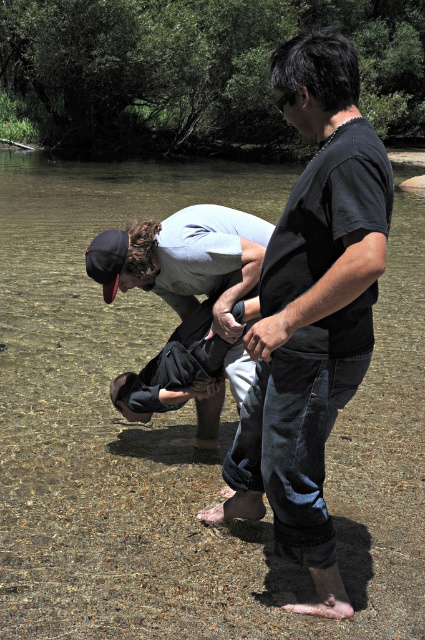
Question: Which object appears farthest from the camera in this image?

Choices:
 (A) light gray cotton shirt at center
 (B) black matte shirt at center

Answer: (A)

Question: Can you confirm if black matte shirt at center is smaller than light gray cotton shirt at center?

Choices:
 (A) yes
 (B) no

Answer: (B)

Question: Can you confirm if black matte shirt at center is positioned above light gray cotton shirt at center?

Choices:
 (A) yes
 (B) no

Answer: (A)

Question: Which point is closer to the camera taking this photo?

Choices:
 (A) (235, 259)
 (B) (255, 445)

Answer: (B)

Question: Which object appears closest to the camera in this image?

Choices:
 (A) light gray cotton shirt at center
 (B) black matte shirt at center

Answer: (B)

Question: From the image, what is the correct spatial relationship of black matte shirt at center in relation to light gray cotton shirt at center?

Choices:
 (A) left
 (B) right

Answer: (B)